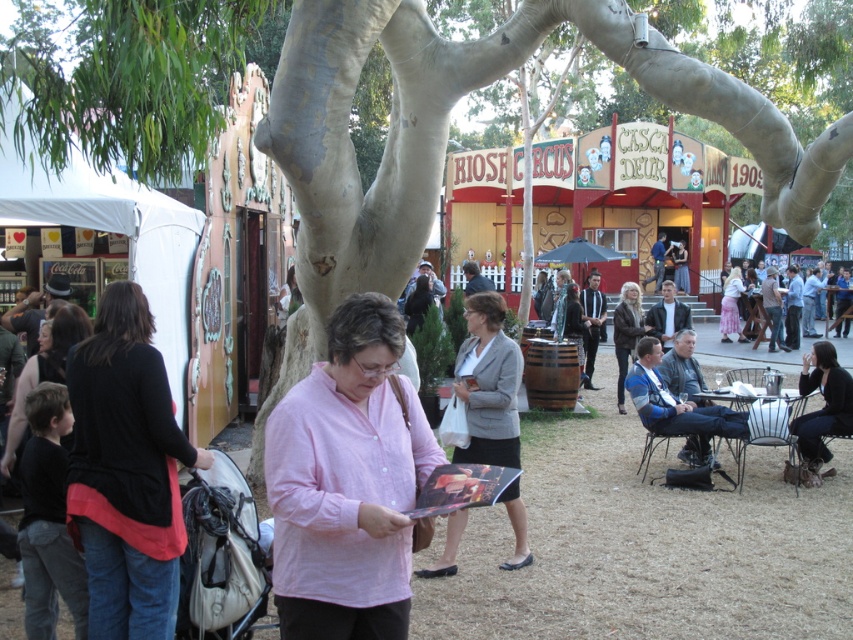
Question: Can you confirm if black leather jacket at lower right is bigger than pink satin skirt at right?

Choices:
 (A) no
 (B) yes

Answer: (A)

Question: Which of the following is the farthest from the observer?

Choices:
 (A) leather jacket at center
 (B) gray fabric jacket at center
 (C) black leather jacket at lower right
 (D) pink cotton shirt at center

Answer: (A)

Question: Does leather jacket at center have a greater width compared to pink satin skirt at right?

Choices:
 (A) yes
 (B) no

Answer: (B)

Question: Among these objects, which one is farthest from the camera?

Choices:
 (A) black leather jacket at lower right
 (B) leather jacket at center
 (C) gray fabric jacket at center
 (D) black matte jacket at left

Answer: (B)

Question: Which point appears farthest from the camera in this image?

Choices:
 (A) (379, 365)
 (B) (828, 428)
 (C) (722, 337)

Answer: (C)

Question: Does pink cotton shirt at center have a larger size compared to leather jacket at center?

Choices:
 (A) no
 (B) yes

Answer: (B)